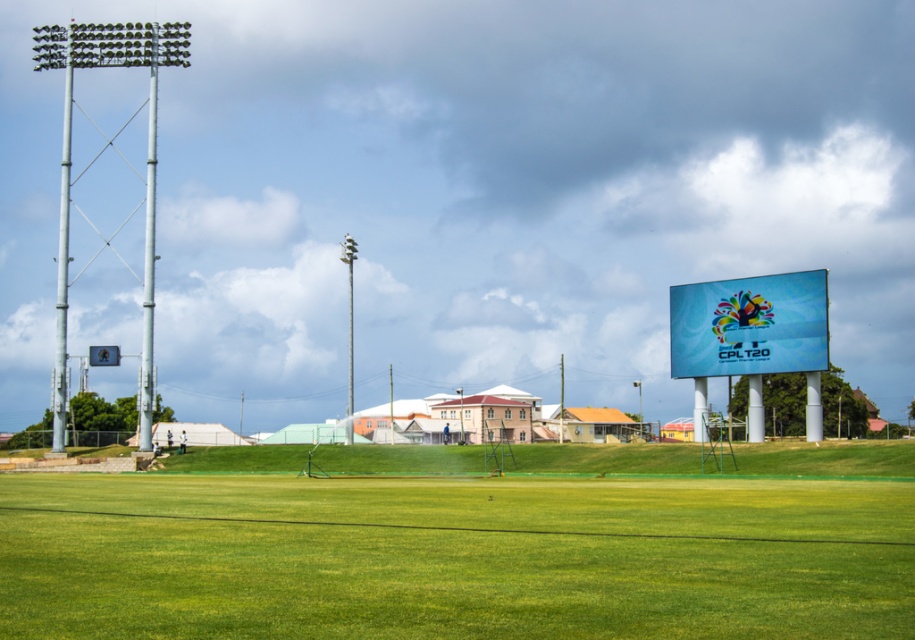
You are a photographer planning to capture the entire sports field and the billboard in one shot. Given that your camera can only focus on objects within a 100m width, will the green grass field at center and the blue glossy sign at upper right fit within the frame?

The green grass field at center has a larger width than the blue glossy sign at upper right. Since the camera can focus on objects within a 100m width, but the exact widths are not provided, it is uncertain if both will fit. However, if the field is the primary subject, prioritize its inclusion within the 100m frame.